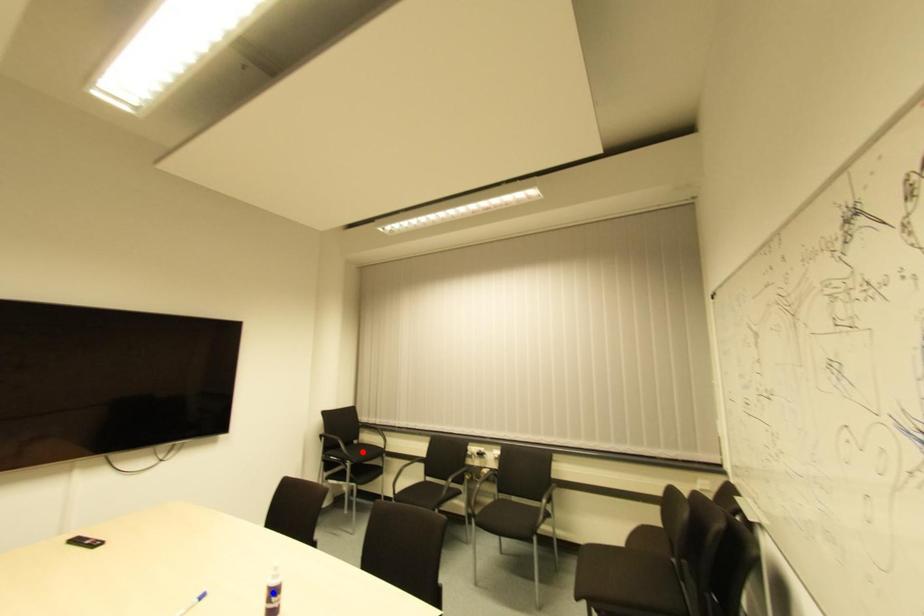
Question: Which of the two points in the image is closer to the camera?

Choices:
 (A) Blue point is closer.
 (B) Red point is closer.

Answer: (A)